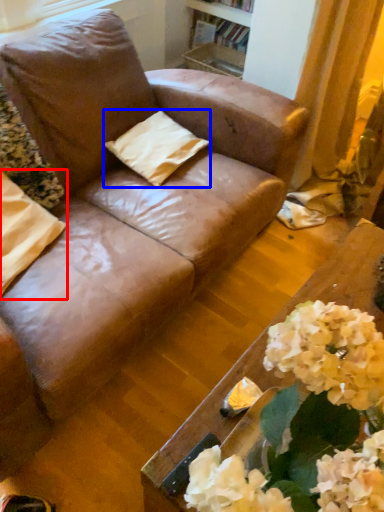
Question: Among these objects, which one is farthest to the camera, pillow (highlighted by a red box) or pillow (highlighted by a blue box)?

Choices:
 (A) pillow
 (B) pillow

Answer: (B)